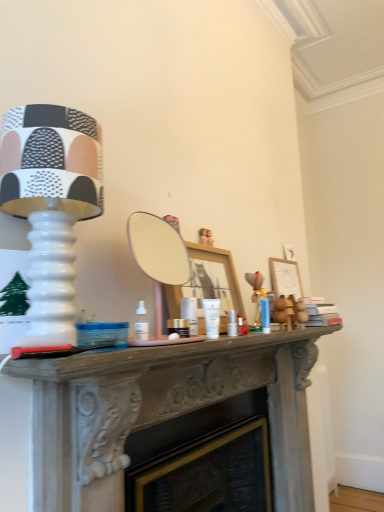
Question: From the image's perspective, is white glossy cream at center under matte white lamp at left?

Choices:
 (A) no
 (B) yes

Answer: (B)

Question: Considering the relative positions of white glossy cream at center and matte white lamp at left in the image provided, is white glossy cream at center to the right of matte white lamp at left from the viewer's perspective?

Choices:
 (A) no
 (B) yes

Answer: (B)

Question: From the image's perspective, is white glossy cream at center above matte white lamp at left?

Choices:
 (A) yes
 (B) no

Answer: (B)

Question: From a real-world perspective, is white glossy cream at center beneath matte white lamp at left?

Choices:
 (A) no
 (B) yes

Answer: (B)

Question: Is white glossy cream at center completely or partially outside of matte white lamp at left?

Choices:
 (A) yes
 (B) no

Answer: (A)

Question: From a real-world perspective, relative to wooden picture frame at right, is matte white lamp at left vertically above or below?

Choices:
 (A) below
 (B) above

Answer: (B)

Question: Considering the positions of matte white lamp at left and wooden picture frame at right in the image, is matte white lamp at left wider or thinner than wooden picture frame at right?

Choices:
 (A) wide
 (B) thin

Answer: (A)

Question: Does point (36, 340) appear closer or farther from the camera than point (294, 272)?

Choices:
 (A) farther
 (B) closer

Answer: (B)

Question: In terms of size, does matte white lamp at left appear bigger or smaller than wooden picture frame at right?

Choices:
 (A) small
 (B) big

Answer: (B)

Question: Which is correct: matte white lamp at left is inside white glossy cream at center, or outside of it?

Choices:
 (A) inside
 (B) outside

Answer: (B)

Question: Does point (49, 268) appear closer or farther from the camera than point (236, 329)?

Choices:
 (A) farther
 (B) closer

Answer: (B)

Question: Considering the relative positions of matte white lamp at left and white glossy cream at center in the image provided, is matte white lamp at left to the left or to the right of white glossy cream at center?

Choices:
 (A) right
 (B) left

Answer: (B)

Question: From the image's perspective, is matte white lamp at left located above or below white glossy cream at center?

Choices:
 (A) below
 (B) above

Answer: (B)

Question: From the image's perspective, is white glossy cream at center above or below wooden picture frame at right?

Choices:
 (A) below
 (B) above

Answer: (A)

Question: Considering the relative positions of white glossy cream at center and wooden picture frame at right in the image provided, is white glossy cream at center to the left or to the right of wooden picture frame at right?

Choices:
 (A) right
 (B) left

Answer: (B)